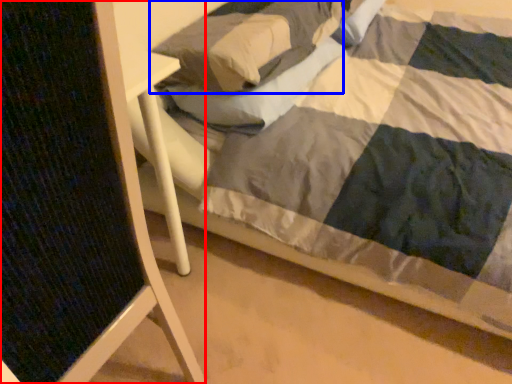
Question: Which point is closer to the camera, folding chair (highlighted by a red box) or pillow (highlighted by a blue box)?

Choices:
 (A) folding chair
 (B) pillow

Answer: (A)